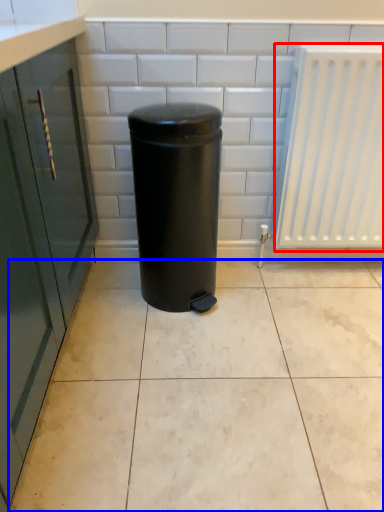
Question: Which object is closer to the camera taking this photo, radiator (highlighted by a red box) or ceramic tile (highlighted by a blue box)?

Choices:
 (A) radiator
 (B) ceramic tile

Answer: (B)